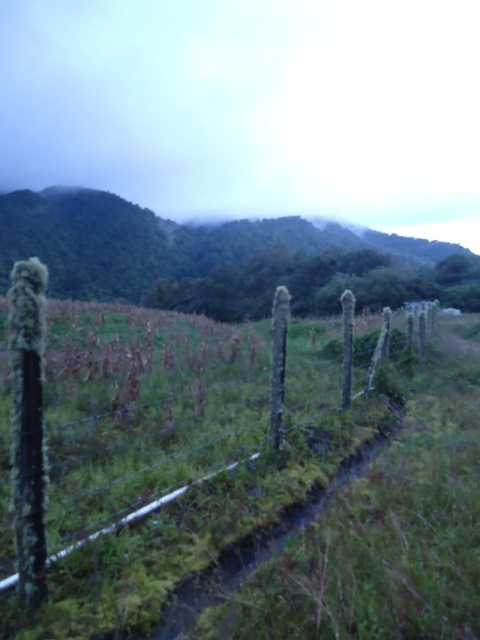
You are standing in a rural landscape and want to walk towards the green mossy wood fence at center and the green mossy fence at lower left. Which fence will you reach first?

The green mossy wood fence at center is closer to the viewer than the green mossy fence at lower left, so you will reach the green mossy wood fence at center first.

You are standing at the lower left corner of the image and want to walk towards the green mossy wood fence at center. Which direction should you move relative to the green mossy fence at lower left?

You should move to the right relative to the green mossy fence at lower left because the green mossy wood fence at center is positioned to the right of it.

Looking at this image, you are standing in a rural landscape and see the green mossy wood fence at center and the green mossy fence at lower left. Which fence is positioned lower in the image?

The green mossy wood fence at center is positioned lower than the green mossy fence at lower left.